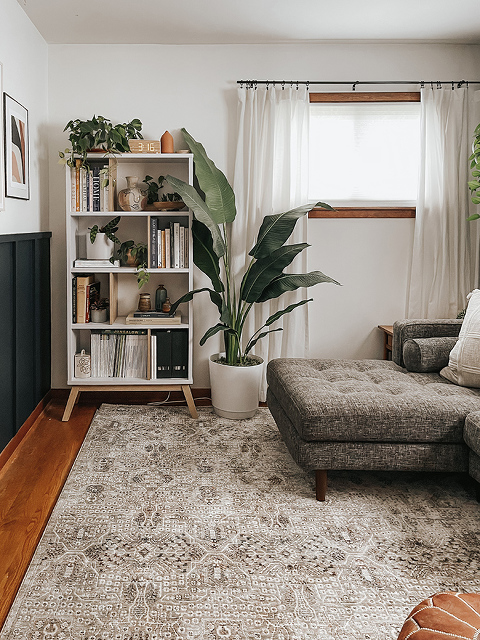
The height and width of the screenshot is (640, 480). Find the location of `bookcase`. bookcase is located at coordinates (124, 304), (132, 169).